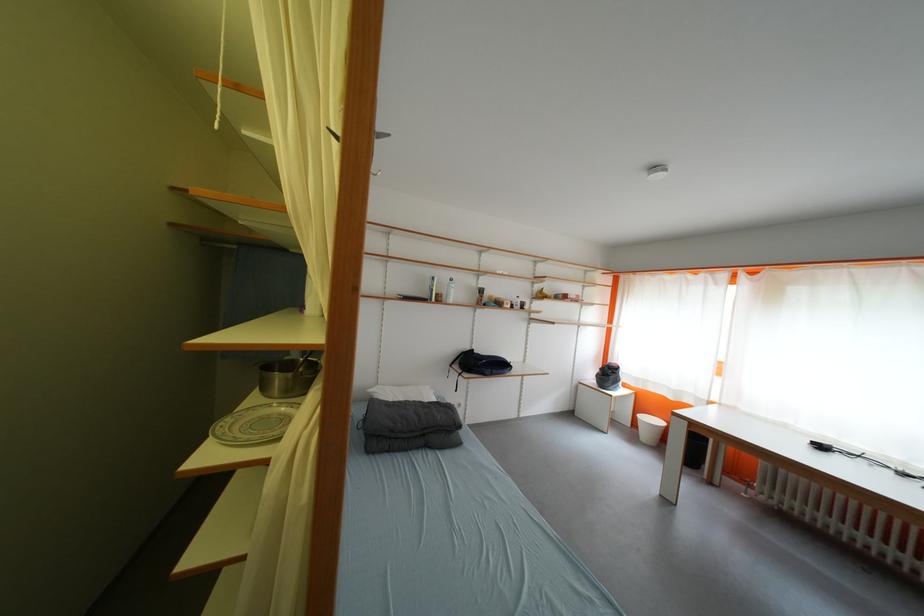
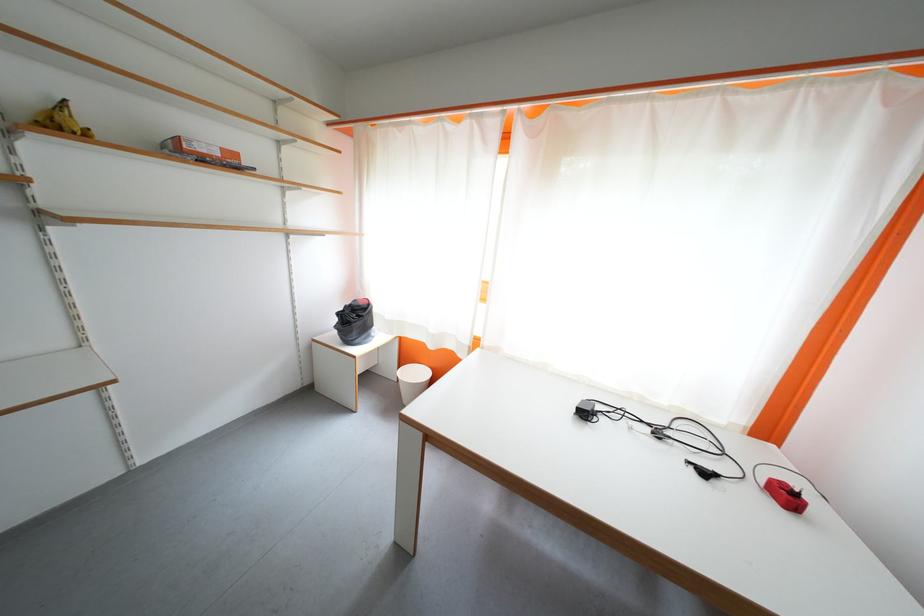
Where in the second image is the point corresponding to point 610,371 from the first image?

(347, 317)